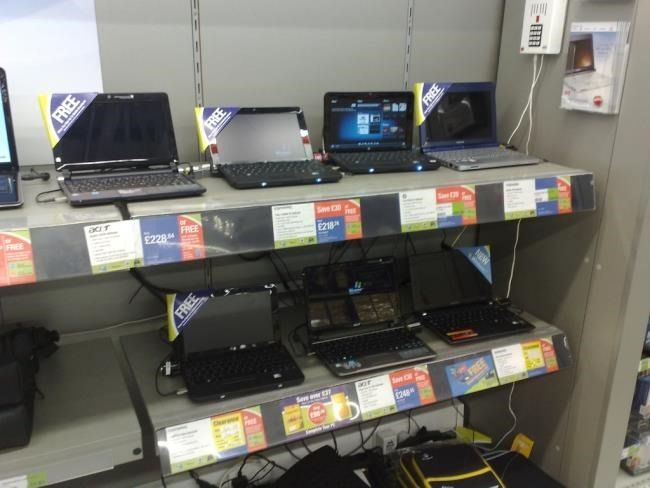
Where is `plastic perspex pamphlet holder`? plastic perspex pamphlet holder is located at coordinates (569, 68).